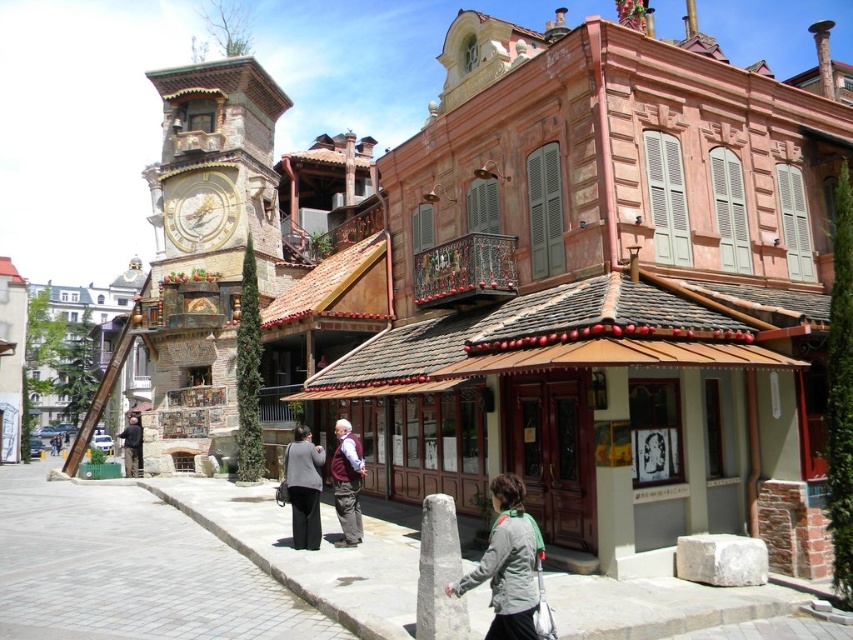
Is gray stone pavement at lower center positioned at the back of dark brown leather jacket at center?

That is False.

Is point (480, 600) farther from viewer compared to point (137, 435)?

No, (480, 600) is closer to viewer.

Locate an element on the screen. gray stone pavement at lower center is located at coordinates (309, 554).

From the picture: Who is lower down, gray brick pavement at center or dark brown leather jacket at center?

dark brown leather jacket at center is lower down.

Image resolution: width=853 pixels, height=640 pixels. I want to click on gray brick pavement at center, so point(129,570).

Is brown stone clock tower at left positioned behind dark brown leather jacket at center?

No.

Between brown stone clock tower at left and dark brown leather jacket at center, which one appears on the right side from the viewer's perspective?

brown stone clock tower at left

Find the location of `brown stone clock tower at left`. brown stone clock tower at left is located at coordinates (207, 243).